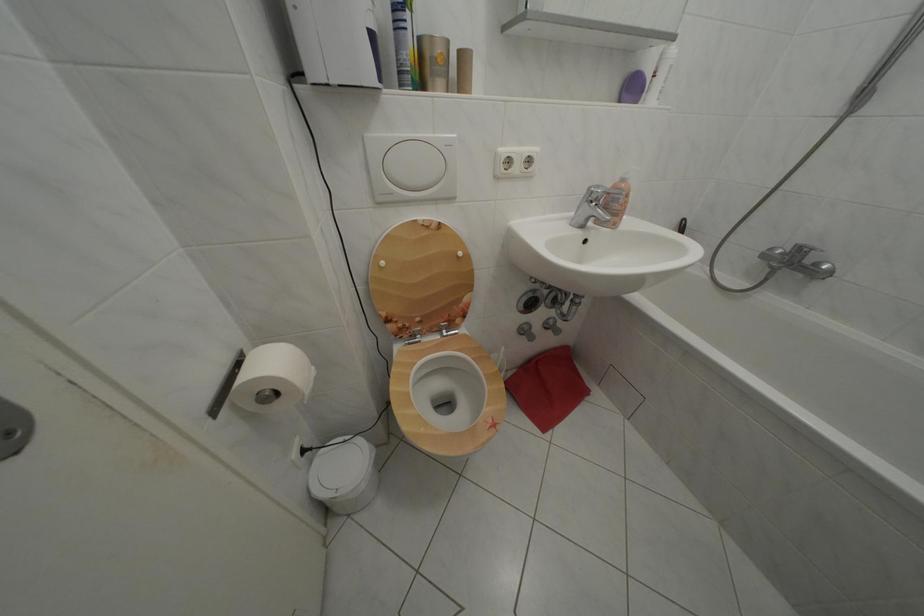
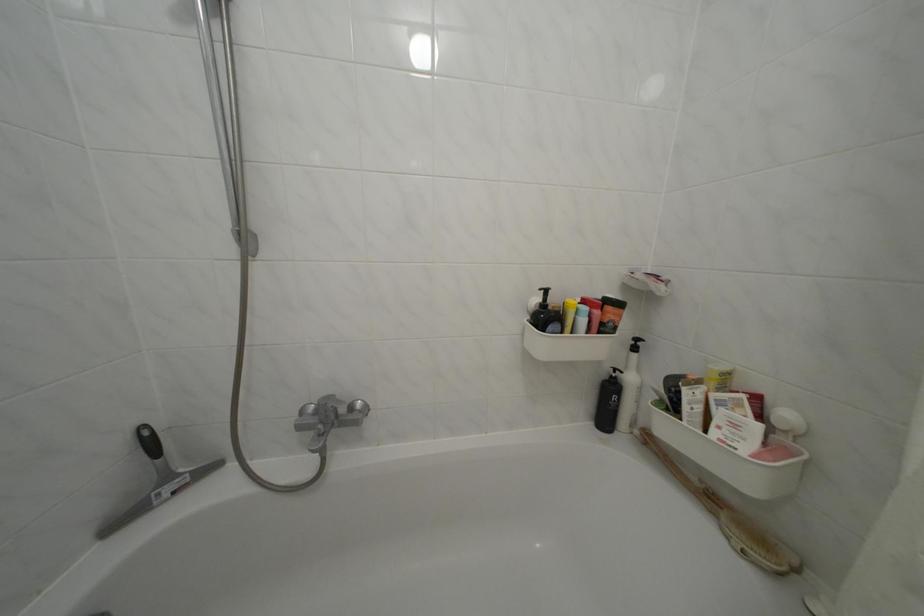
The point at (824, 270) is marked in the first image. Where is the corresponding point in the second image?

(359, 414)